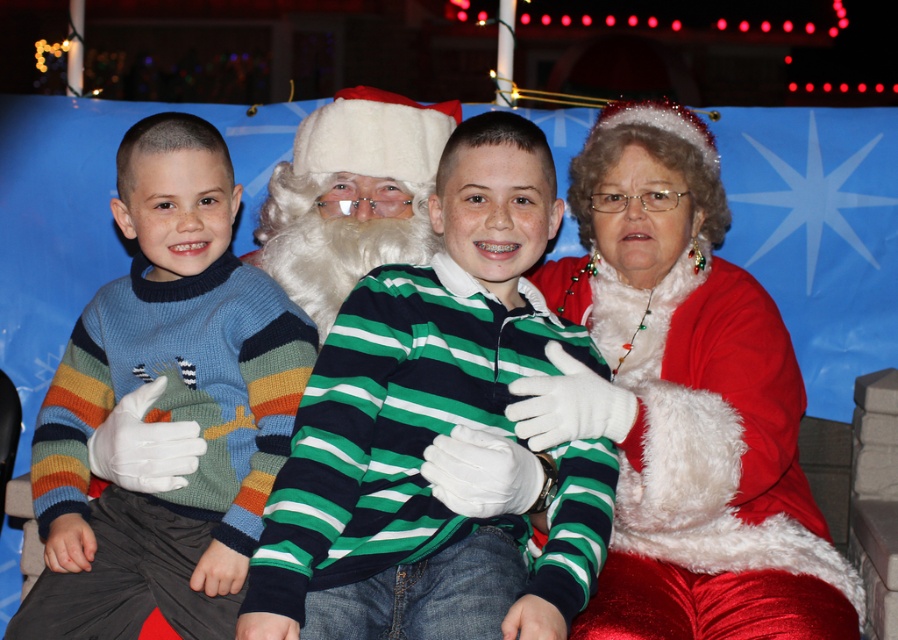
Which is more to the left, red velvet santa suit at right or white fluffy beard at center?

Positioned to the left is white fluffy beard at center.

Which is in front, point (627, 618) or point (323, 275)?

Point (627, 618) is more forward.

The image size is (898, 640). I want to click on red velvet santa suit at right, so click(x=684, y=401).

Does green striped sweater at center appear under red velvet santa suit at right?

Yes, green striped sweater at center is below red velvet santa suit at right.

At what (x,y) coordinates should I click in order to perform the action: click on green striped sweater at center. Please return your answer as a coordinate pair (x, y). Looking at the image, I should click on (434, 429).

Find the location of a particular element. The width and height of the screenshot is (898, 640). green striped sweater at center is located at coordinates (434, 429).

Is green striped sweater at center shorter than white fluffy beard at center?

No, green striped sweater at center is not shorter than white fluffy beard at center.

Which is in front, point (251, 563) or point (381, 244)?

Point (251, 563) is more forward.

Identify the location of green striped sweater at center. (434, 429).